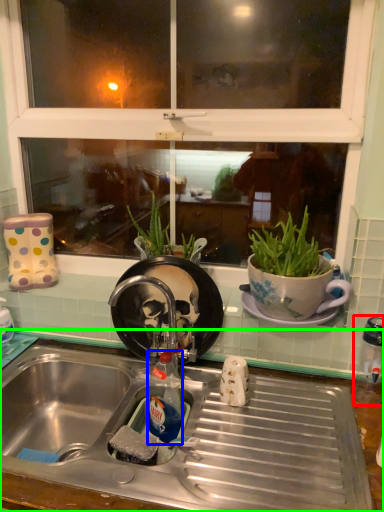
Question: Estimate the real-world distances between objects in this image. Which object is farther from appliance (highlighted by a red box), bottle (highlighted by a blue box) or desk (highlighted by a green box)?

Choices:
 (A) bottle
 (B) desk

Answer: (A)